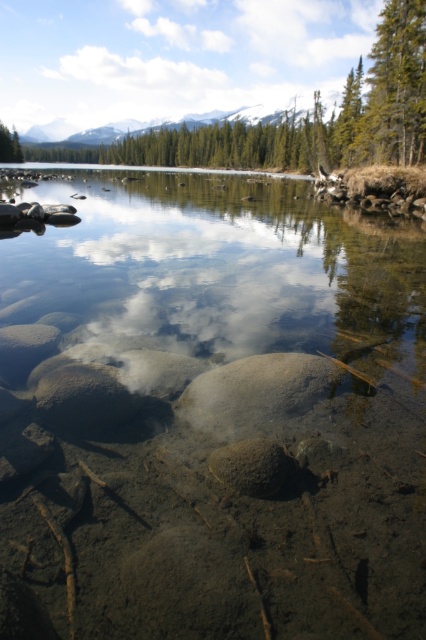
Which is in front, point (160, 273) or point (394, 67)?

Point (160, 273) is in front.

The image size is (426, 640). What do you see at coordinates (218, 268) in the screenshot?
I see `clear water at center` at bounding box center [218, 268].

Identify the location of clear water at center. This screenshot has width=426, height=640. (218, 268).